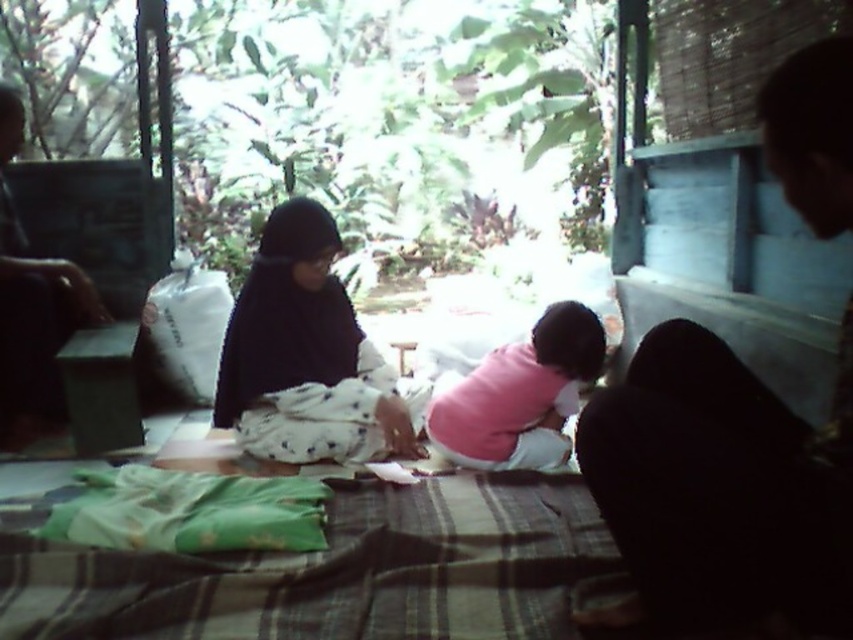
Looking at this image, you are organizing a baby shower and need to arrange the decorations. You have a black fabric at right and a pink soft fabric baby at center. According to the image, which fabric is positioned to the right of the other?

The black fabric at right is positioned to the right of the pink soft fabric baby at center.

You are standing in the room and see the point at coordinates [712,492]. What object is located at that point?

The point at coordinates [712,492] corresponds to the black fabric at right.